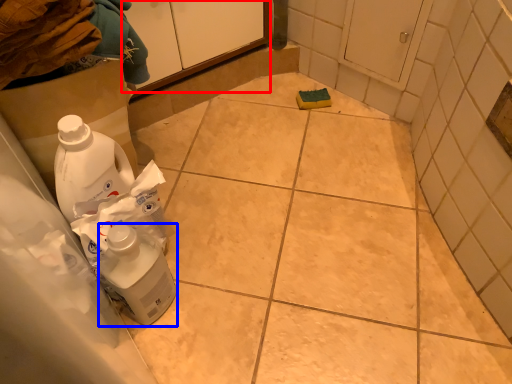
Question: Which object is closer to the camera taking this photo, cabinetry (highlighted by a red box) or cleaning product (highlighted by a blue box)?

Choices:
 (A) cabinetry
 (B) cleaning product

Answer: (B)